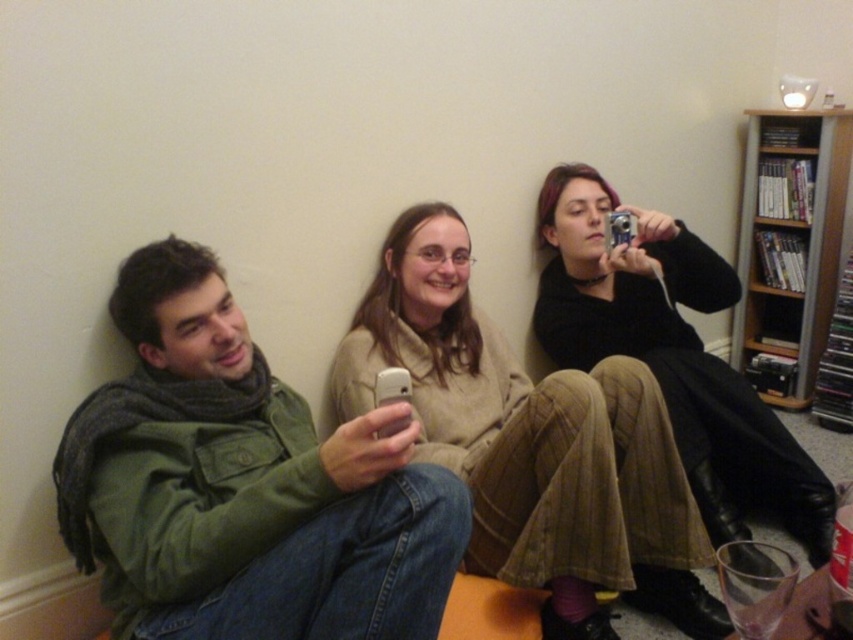
You are trying to hang a picture frame that requires a hook 1 meter high on the wall. Given the positions of the matte green jacket at left and the wooden bookshelf at upper right, which object is closer to where the hook should be placed?

The wooden bookshelf at upper right is closer to where the hook should be placed since it is taller than the matte green jacket at left, making it nearer to the 1 meter height requirement.

You are standing in a room with a plain off white wall and want to place a matte black camera at center and a wooden bookshelf at upper right. Based on the scene description, which object is located to the left of the other?

The matte black camera at center is positioned on the left side of wooden bookshelf at upper right.

You are trying to take a photo of the wooden bookshelf at upper right but there is a matte black camera at center in the way. Can you move the camera to the side to get a clear shot?

The matte black camera at center is positioned under the wooden bookshelf at upper right, so moving it to the side would allow you to see the bookshelf clearly.